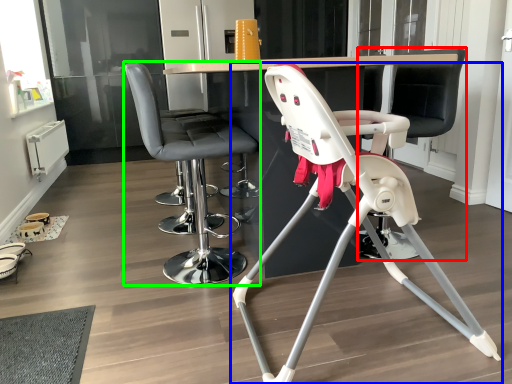
Question: Which object is the closest to the swivel chair (highlighted by a red box)? Choose among these: chair (highlighted by a blue box) or chair (highlighted by a green box).

Choices:
 (A) chair
 (B) chair

Answer: (A)